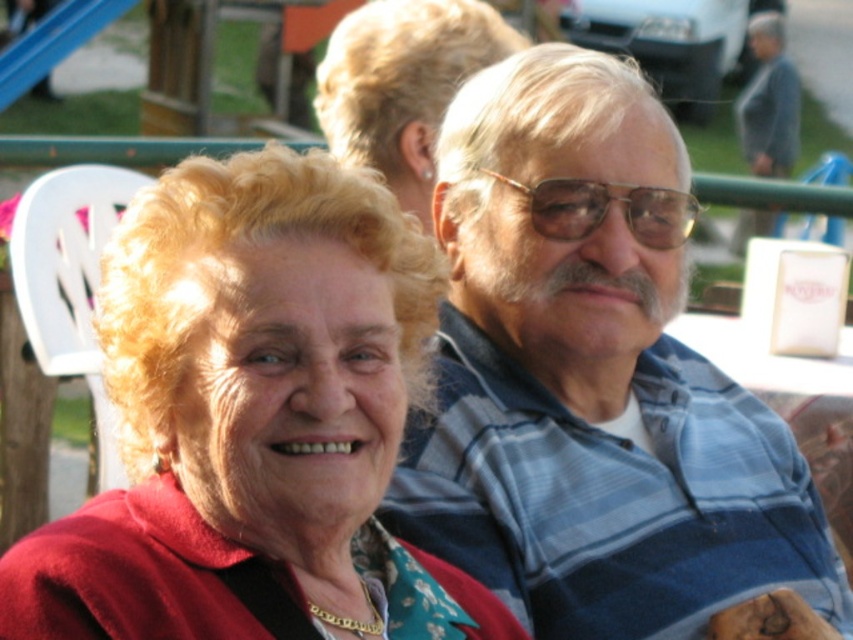
Who is positioned more to the left, matte red sweater at center or blonde hair at upper center?

matte red sweater at center is more to the left.

Is matte red sweater at center taller than blonde hair at upper center?

Yes.

Is point (355, 276) farther from viewer compared to point (343, 20)?

That is False.

I want to click on matte red sweater at center, so click(253, 420).

Can you confirm if blue striped shirt at upper right is positioned to the left of matte red sweater at center?

No, blue striped shirt at upper right is not to the left of matte red sweater at center.

Who is more distant from viewer, (460, 422) or (350, 403)?

The point (460, 422) is behind.

In order to click on blue striped shirt at upper right in this screenshot , I will do `click(596, 384)`.

Does blue striped shirt at upper right appear on the right side of blonde hair at upper center?

Yes, blue striped shirt at upper right is to the right of blonde hair at upper center.

Can you confirm if blue striped shirt at upper right is positioned below blonde hair at upper center?

Yes, blue striped shirt at upper right is below blonde hair at upper center.

Is point (566, 61) positioned in front of point (428, 0)?

Yes, point (566, 61) is in front of point (428, 0).

You are a GUI agent. You are given a task and a screenshot of the screen. Output one action in this format:
    pyautogui.click(x=<x>, y=<y>)
    Task: Click on the blue striped shirt at upper right
    The width and height of the screenshot is (853, 640).
    Given the screenshot: What is the action you would take?
    pyautogui.click(x=596, y=384)